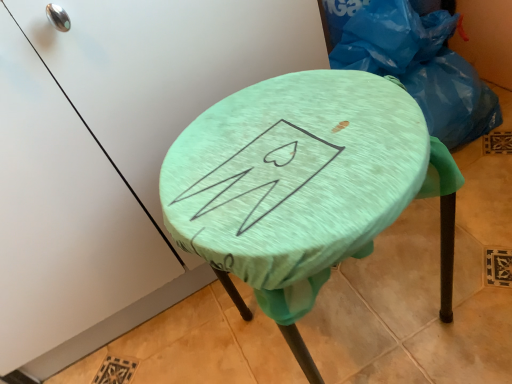
Question: From the image's perspective, is mint fabric-covered stool at center located above blue plastic bag at upper right?

Choices:
 (A) yes
 (B) no

Answer: (B)

Question: Is mint fabric-covered stool at center closer to the viewer compared to blue plastic bag at upper right?

Choices:
 (A) yes
 (B) no

Answer: (A)

Question: Considering the relative positions of mint fabric-covered stool at center and blue plastic bag at upper right in the image provided, is mint fabric-covered stool at center behind blue plastic bag at upper right?

Choices:
 (A) yes
 (B) no

Answer: (B)

Question: Is mint fabric-covered stool at center aimed at blue plastic bag at upper right?

Choices:
 (A) no
 (B) yes

Answer: (A)

Question: Is mint fabric-covered stool at center completely or partially outside of blue plastic bag at upper right?

Choices:
 (A) yes
 (B) no

Answer: (A)

Question: From the image's perspective, is mint fabric-covered stool at center below blue plastic bag at upper right?

Choices:
 (A) yes
 (B) no

Answer: (A)

Question: Can we say blue plastic bag at upper right lies outside mint fabric-covered stool at center?

Choices:
 (A) yes
 (B) no

Answer: (A)

Question: Considering the relative sizes of blue plastic bag at upper right and mint fabric-covered stool at center in the image provided, is blue plastic bag at upper right bigger than mint fabric-covered stool at center?

Choices:
 (A) yes
 (B) no

Answer: (B)

Question: From a real-world perspective, is blue plastic bag at upper right beneath mint fabric-covered stool at center?

Choices:
 (A) no
 (B) yes

Answer: (A)

Question: Can you confirm if blue plastic bag at upper right is smaller than mint fabric-covered stool at center?

Choices:
 (A) no
 (B) yes

Answer: (B)

Question: Is blue plastic bag at upper right not near mint fabric-covered stool at center?

Choices:
 (A) no
 (B) yes

Answer: (A)

Question: From the image's perspective, is blue plastic bag at upper right above mint fabric-covered stool at center?

Choices:
 (A) yes
 (B) no

Answer: (A)

Question: In terms of size, does mint fabric-covered stool at center appear bigger or smaller than blue plastic bag at upper right?

Choices:
 (A) big
 (B) small

Answer: (A)